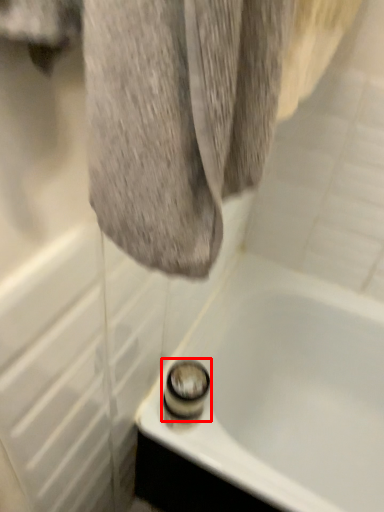
Question: In this image, where is shower (annotated by the red box) located relative to bathtub?

Choices:
 (A) right
 (B) left

Answer: (B)